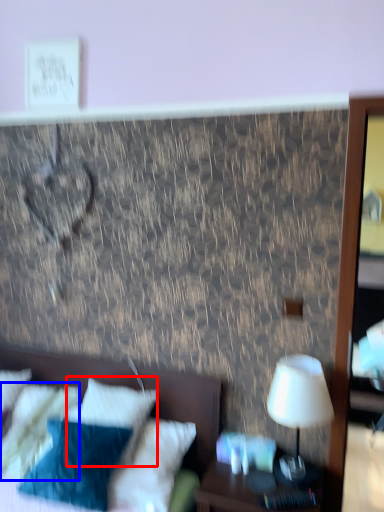
Question: Which object is closer to the camera taking this photo, pillow (highlighted by a red box) or pillow (highlighted by a blue box)?

Choices:
 (A) pillow
 (B) pillow

Answer: (A)